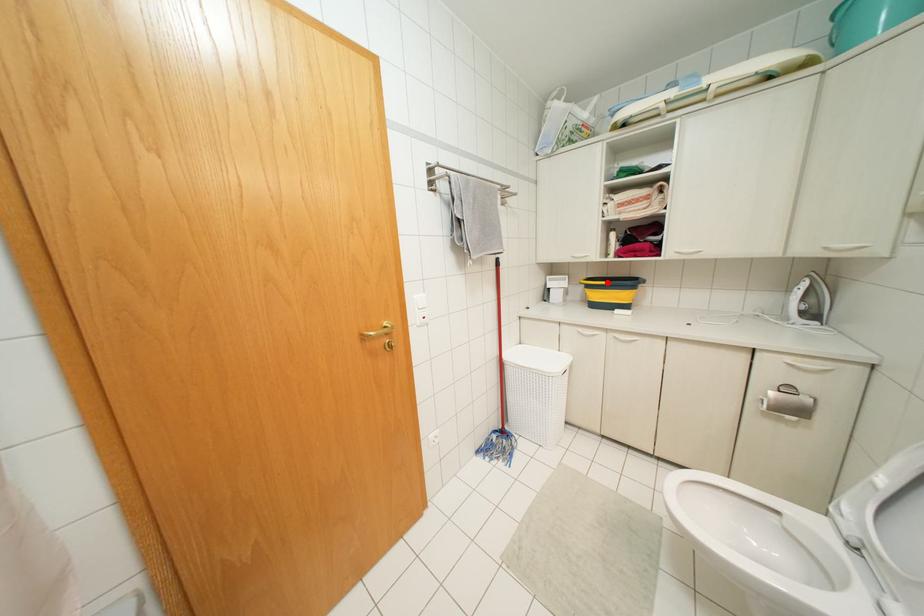
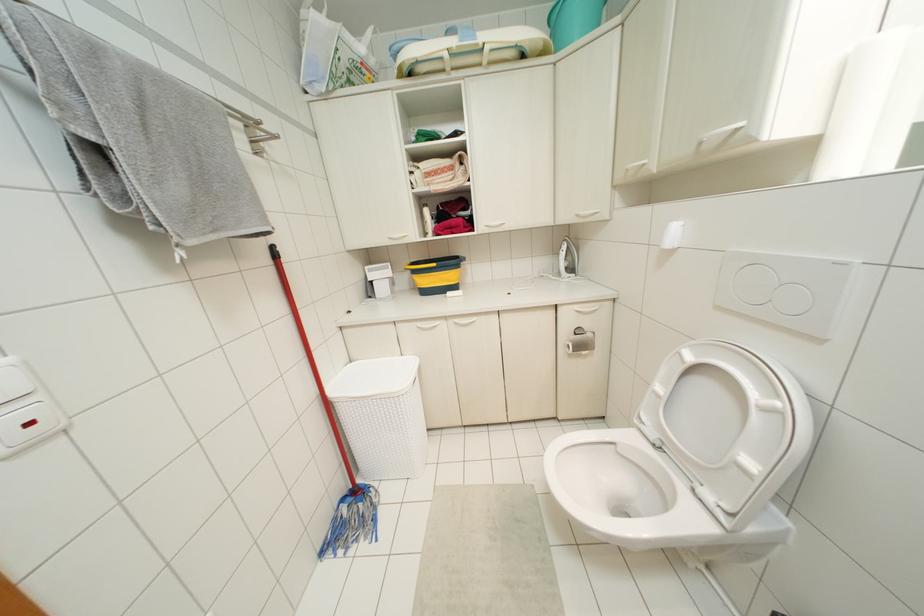
Find the pixel in the second image that matches the highlighted location in the first image.

(433, 264)